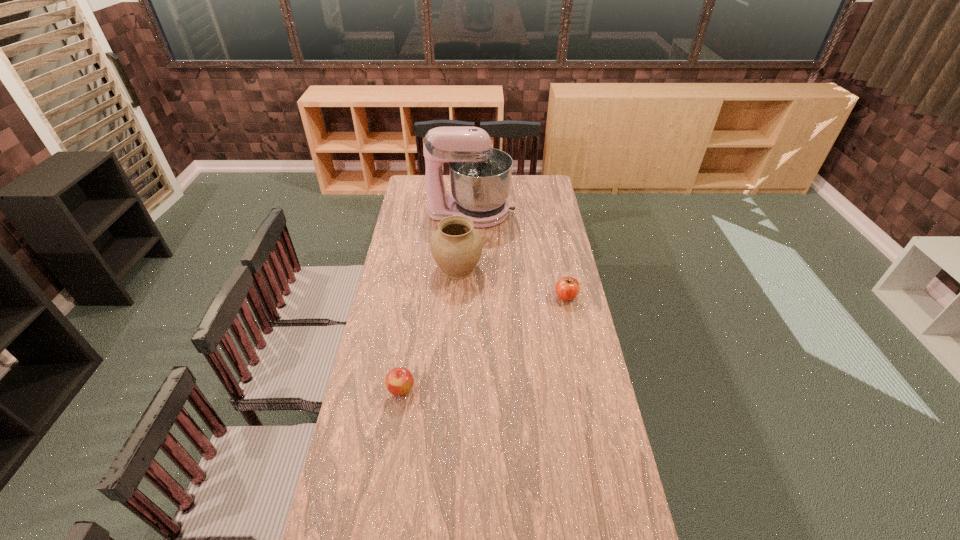
The height and width of the screenshot is (540, 960). Find the location of `mixer`. mixer is located at coordinates (480, 176).

This screenshot has height=540, width=960. Find the location of `the farthest object`. the farthest object is located at coordinates (480, 176).

The image size is (960, 540). I want to click on the third shortest object, so click(456, 246).

Locate an element on the screen. The height and width of the screenshot is (540, 960). urn is located at coordinates [456, 246].

The image size is (960, 540). What are the coordinates of `the right apple` in the screenshot? It's located at (567, 288).

The width and height of the screenshot is (960, 540). I want to click on the rightmost object, so click(567, 288).

Where is `the left apple`? the left apple is located at coordinates (399, 381).

Identify the location of the nearest object. The width and height of the screenshot is (960, 540). (399, 381).

What are the coordinates of `vacant space located 0.200m on the front-facing side of the farthest object` in the screenshot? It's located at (552, 212).

This screenshot has width=960, height=540. I want to click on free region located on the right of the urn, so click(x=568, y=268).